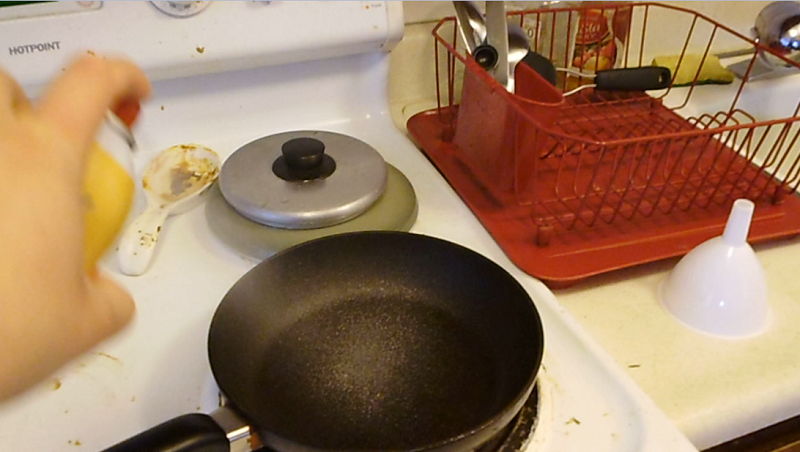
I want to click on kitchen top, so click(712, 375).